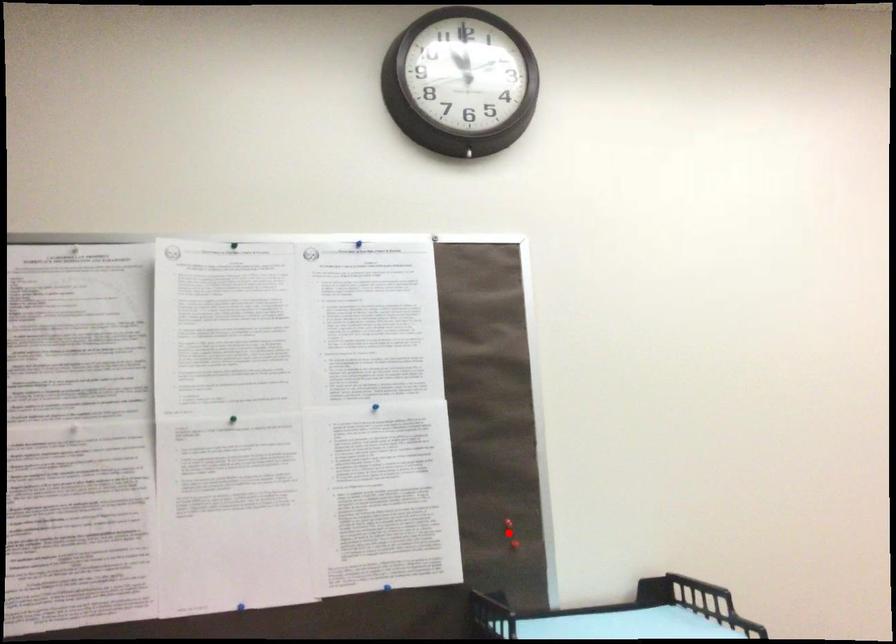
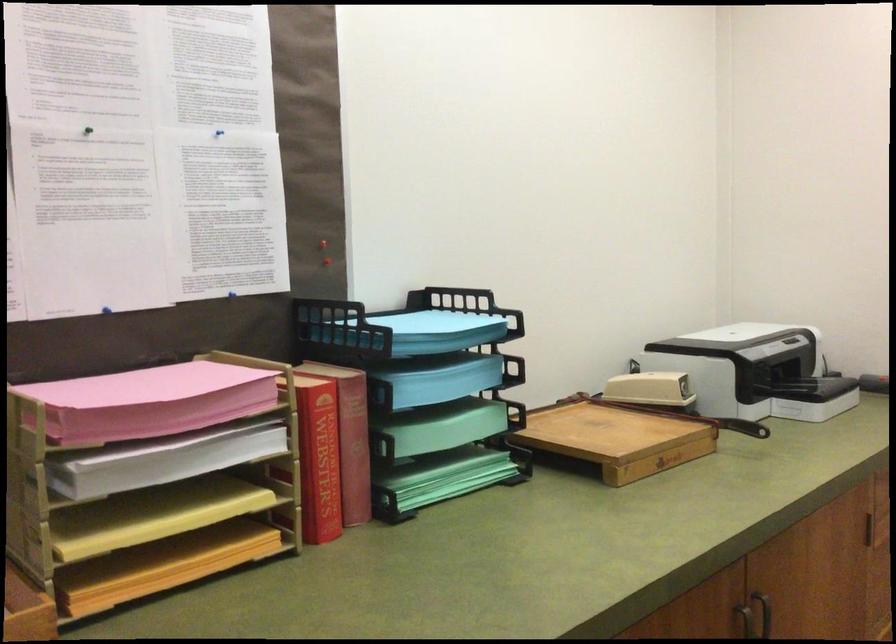
Locate, in the second image, the point that corresponds to the highlighted location in the first image.

(323, 252)